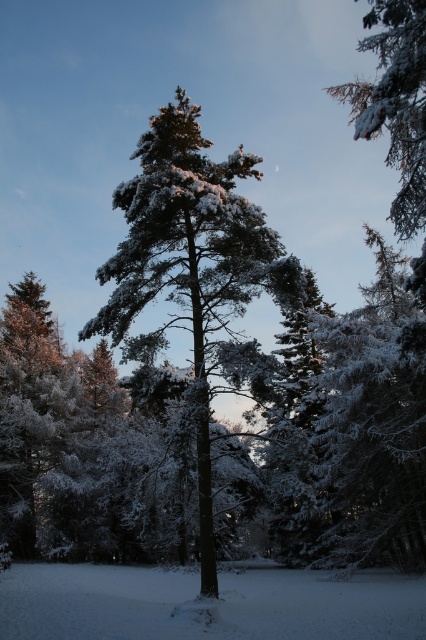
Who is positioned more to the left, white fluffy snow at center or slightly frosted pine branch at upper right?

Positioned to the left is white fluffy snow at center.

Which is below, white fluffy snow at center or slightly frosted pine branch at upper right?

Positioned lower is white fluffy snow at center.

Is point (131, 621) more distant than point (411, 20)?

No, it is not.

This screenshot has height=640, width=426. What are the coordinates of `white fluffy snow at center` in the screenshot? It's located at (215, 604).

Between point (138, 296) and point (389, 152), which one is positioned behind?

Positioned behind is point (389, 152).

Between snow-covered pine tree at center and slightly frosted pine branch at upper right, which one has more height?

snow-covered pine tree at center is taller.

Is point (172, 321) in front of point (397, 120)?

That is False.

The height and width of the screenshot is (640, 426). In order to click on snow-covered pine tree at center in this screenshot , I will do [192, 262].

Between point (192, 195) and point (365, 627), which one is positioned behind?

Point (192, 195)

Does point (198, 246) lie in front of point (31, 616)?

No, (198, 246) is behind (31, 616).

This screenshot has width=426, height=640. In order to click on snow-covered pine tree at center in this screenshot , I will do `click(192, 262)`.

Where is `snow-covered pine tree at center`? This screenshot has width=426, height=640. snow-covered pine tree at center is located at coordinates (192, 262).